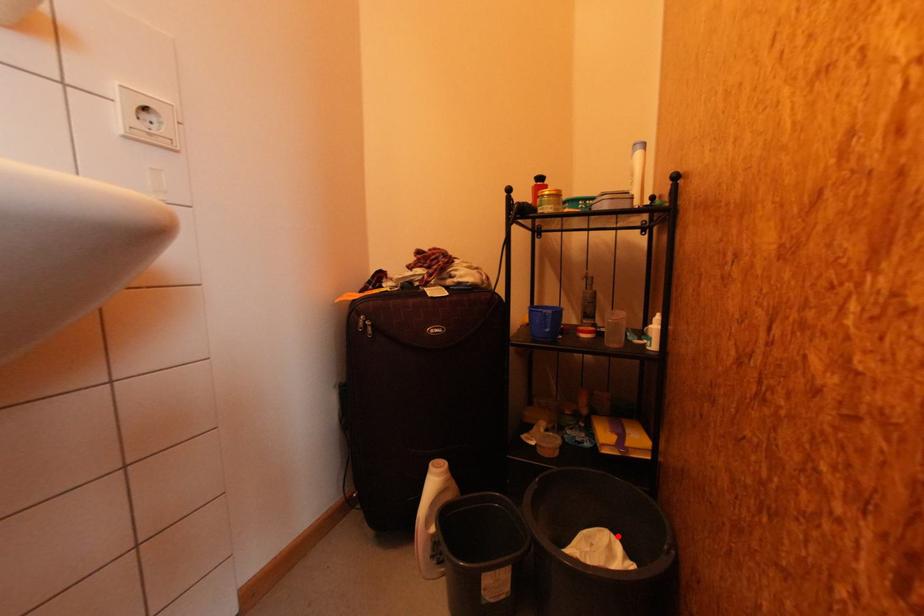
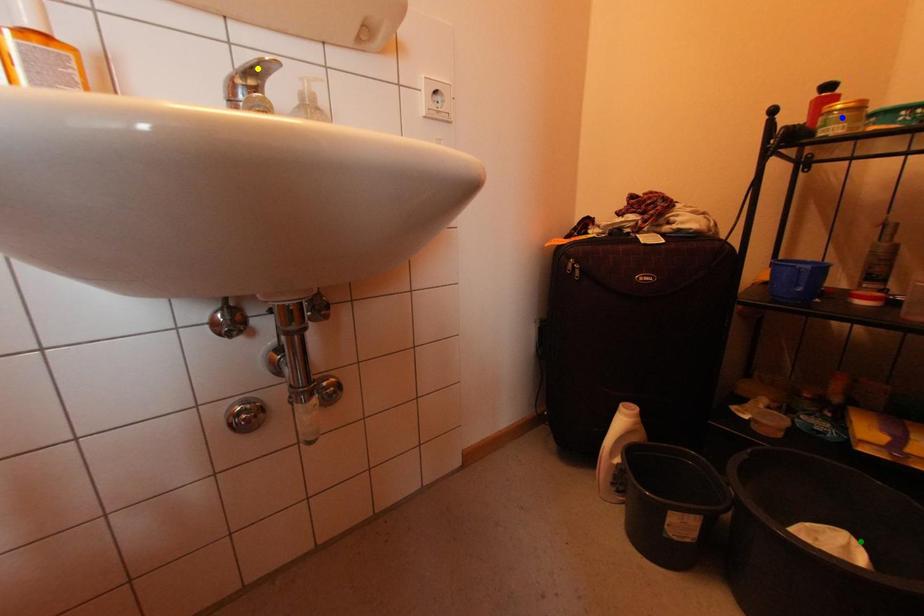
Question: I am providing you with two images of the same scene from different viewpoints. A red point is marked on the first image. You are given multiple points on the second image. Which mark in image 2 goes with the point in image 1?

Choices:
 (A) yellow point
 (B) green point
 (C) blue point

Answer: (B)